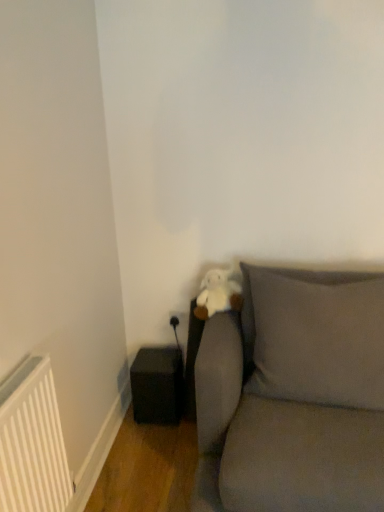
Question: Is white plush toy at center in front of matte gray pillow at center?

Choices:
 (A) yes
 (B) no

Answer: (B)

Question: From the image's perspective, would you say white plush toy at center is shown under matte gray pillow at center?

Choices:
 (A) yes
 (B) no

Answer: (B)

Question: From a real-world perspective, does white plush toy at center stand above matte gray pillow at center?

Choices:
 (A) no
 (B) yes

Answer: (B)

Question: Is white plush toy at center positioned behind matte gray pillow at center?

Choices:
 (A) no
 (B) yes

Answer: (B)

Question: Is matte gray pillow at center completely or partially inside white plush toy at center?

Choices:
 (A) yes
 (B) no

Answer: (B)

Question: Does white plush toy at center have a lesser height compared to matte gray pillow at center?

Choices:
 (A) no
 (B) yes

Answer: (B)

Question: Is white plush toy at center looking in the opposite direction of white matte radiator at lower left?

Choices:
 (A) no
 (B) yes

Answer: (A)

Question: Is the depth of white plush toy at center greater than that of white matte radiator at lower left?

Choices:
 (A) no
 (B) yes

Answer: (B)

Question: Is white plush toy at center shorter than white matte radiator at lower left?

Choices:
 (A) no
 (B) yes

Answer: (B)

Question: From a real-world perspective, is white plush toy at center located higher than white matte radiator at lower left?

Choices:
 (A) no
 (B) yes

Answer: (B)

Question: Does white plush toy at center have a smaller size compared to white matte radiator at lower left?

Choices:
 (A) no
 (B) yes

Answer: (B)

Question: Is white plush toy at center thinner than white matte radiator at lower left?

Choices:
 (A) yes
 (B) no

Answer: (B)

Question: Is matte gray pillow at center next to gray fabric couch at lower right?

Choices:
 (A) no
 (B) yes

Answer: (B)